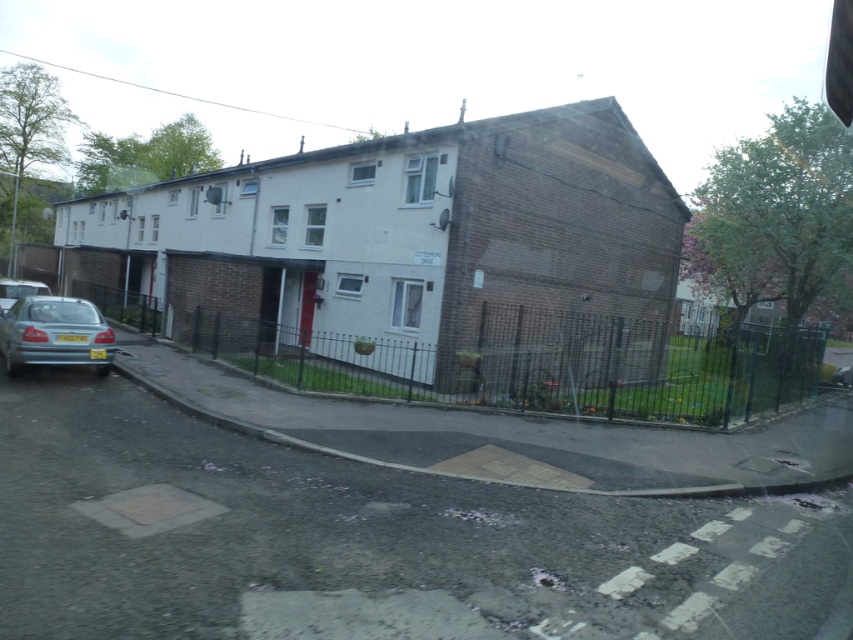
In order to click on silver metallic car at lower left in this screenshot , I will do tap(54, 333).

Is point (97, 320) farther from viewer compared to point (25, 282)?

That is False.

At what (x,y) coordinates should I click in order to perform the action: click on silver metallic car at lower left. Please return your answer as a coordinate pair (x, y). Looking at the image, I should click on (54, 333).